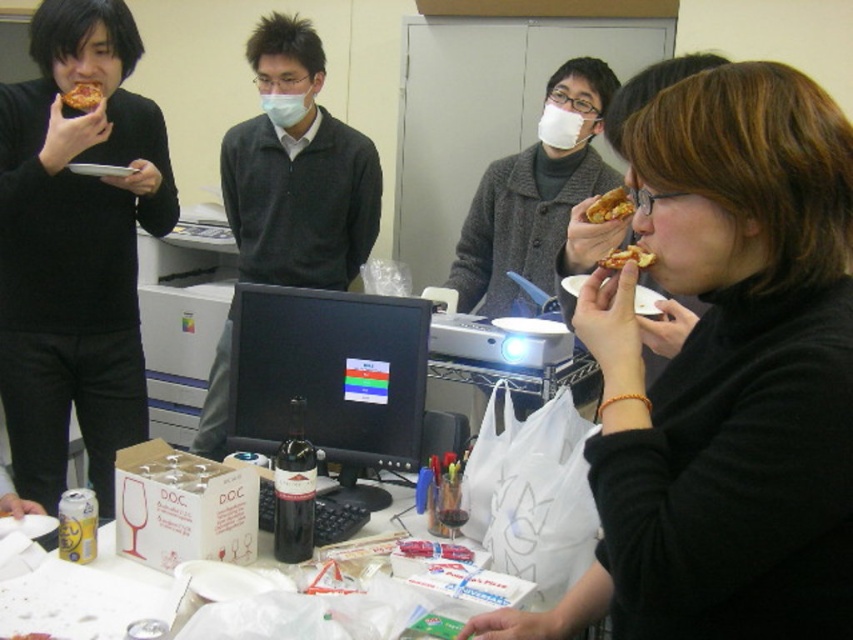
You are standing in the office space shown in the image and want to grab the matte gray sweater at center. Considering your height is 1.7 meters, can you reach it?

The matte gray sweater at center is 2.42 meters away from the viewer, which is beyond the typical reaching distance for someone of 1.7 meters in height. You would need to move closer or use a tool to reach it.

You are a delivery person who just arrived with a package. You need to place the package on the nearest available surface. You see the matte gray sweater at center and the golden crispy pizza slice at upper left. Which one is closer to you?

The matte gray sweater at center is closer to you since it is only 30.29 inches away from the golden crispy pizza slice at upper left, making it the nearest available surface.